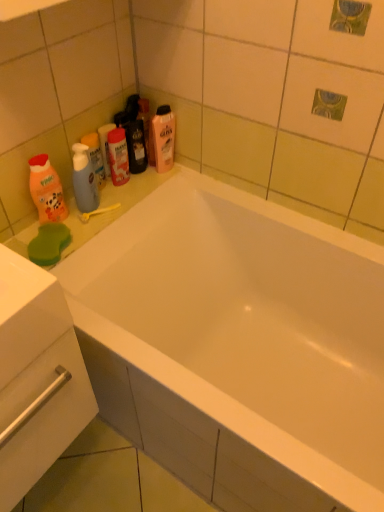
The height and width of the screenshot is (512, 384). In order to click on free spot in front of yellow plastic toothbrush at upper left in this screenshot , I will do `click(83, 232)`.